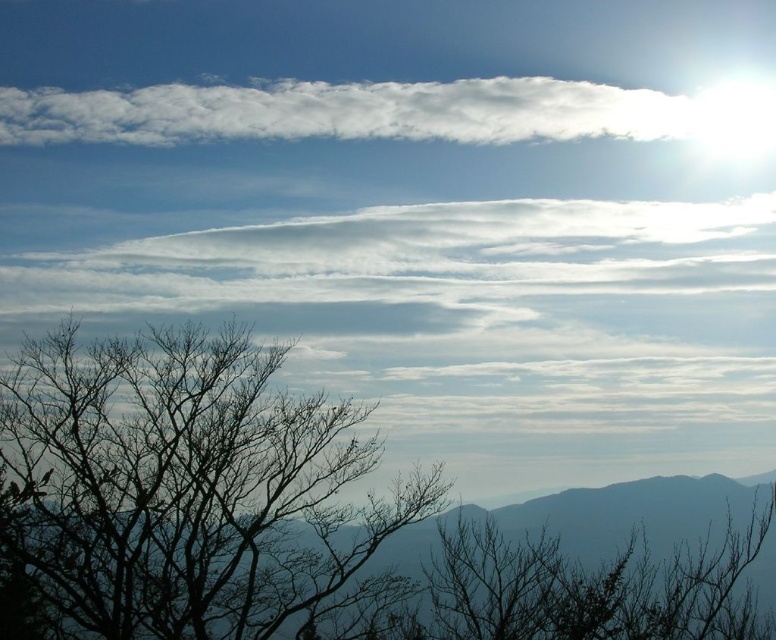
Question: Among these objects, which one is farthest from the camera?

Choices:
 (A) white fluffy cloud at upper center
 (B) black bare tree at left

Answer: (A)

Question: Does black bare tree at left have a lesser width compared to white fluffy cloud at upper center?

Choices:
 (A) yes
 (B) no

Answer: (A)

Question: Is black bare tree at left to the right of white fluffy cloud at upper center from the viewer's perspective?

Choices:
 (A) yes
 (B) no

Answer: (B)

Question: Which point is closer to the camera?

Choices:
 (A) white fluffy cloud at upper center
 (B) black bare tree at left

Answer: (B)

Question: Does black bare tree at left appear on the right side of white fluffy cloud at upper center?

Choices:
 (A) no
 (B) yes

Answer: (A)

Question: Among these objects, which one is nearest to the camera?

Choices:
 (A) black bare tree at left
 (B) white fluffy cloud at upper center

Answer: (A)